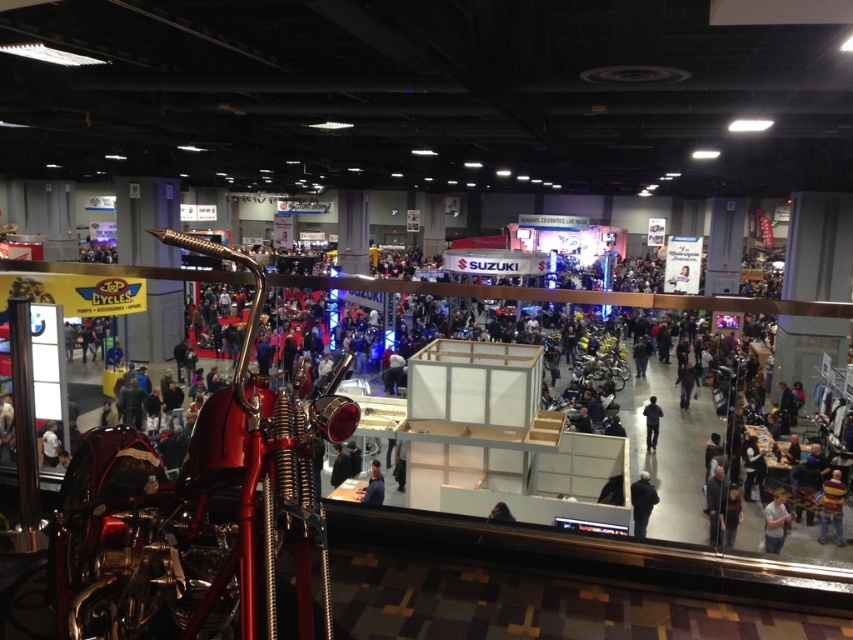
You are at the motorcycle show and want to take a photo of the shiny chrome motorcycle at lower left without anyone blocking the view. The light blue shirt at lower right is in the way. In which direction should you move to get a clear shot?

The shiny chrome motorcycle at lower left is to the left of the light blue shirt at lower right. To avoid the light blue shirt at lower right, you should move to the left side of the light blue shirt at lower right so that the motorcycle is no longer obstructed.

You are standing at the entrance of the motorcycle exhibition and want to take a photo of the two points in the scene. The first point is labeled as point [781,493] and the second is point [631,508]. Which point should you focus on first to ensure both are in the frame without moving the camera?

You should focus on point [631,508] first because it is in front of point [781,493]. Since point [781,493] is behind point [631,508], focusing on the closer point will help keep both in the frame by maintaining depth of field.

You are standing at the entrance of the event space and see the point marked as point (831, 506). What object is located at this point?

The striped sweater at lower right is located at point (831, 506).